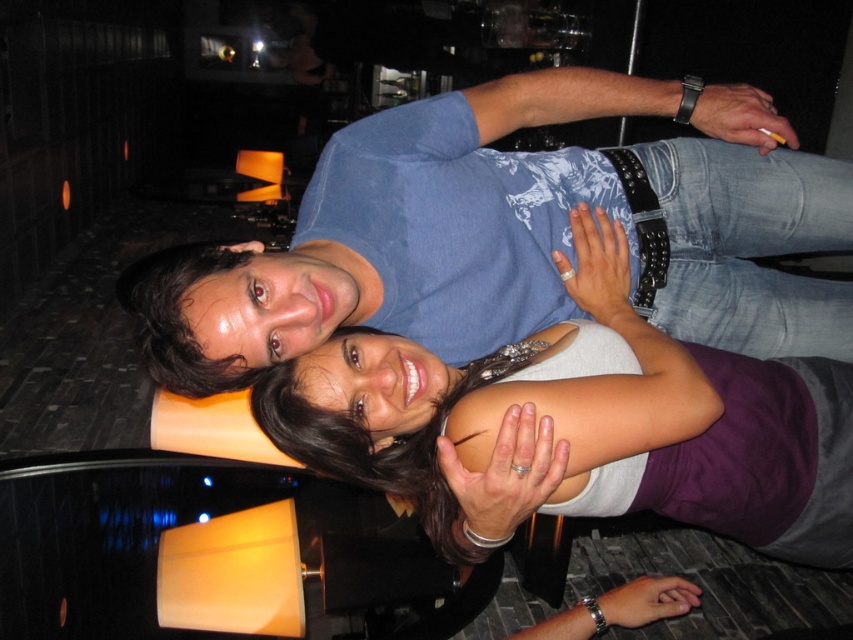
Can you confirm if blue cotton shirt at upper center is positioned above matte white tank top at center?

Indeed, blue cotton shirt at upper center is positioned over matte white tank top at center.

Can you confirm if blue cotton shirt at upper center is smaller than matte white tank top at center?

No.

Is point (584, 154) behind point (752, 436)?

Yes.

Where is `blue cotton shirt at upper center`? Image resolution: width=853 pixels, height=640 pixels. blue cotton shirt at upper center is located at coordinates (518, 234).